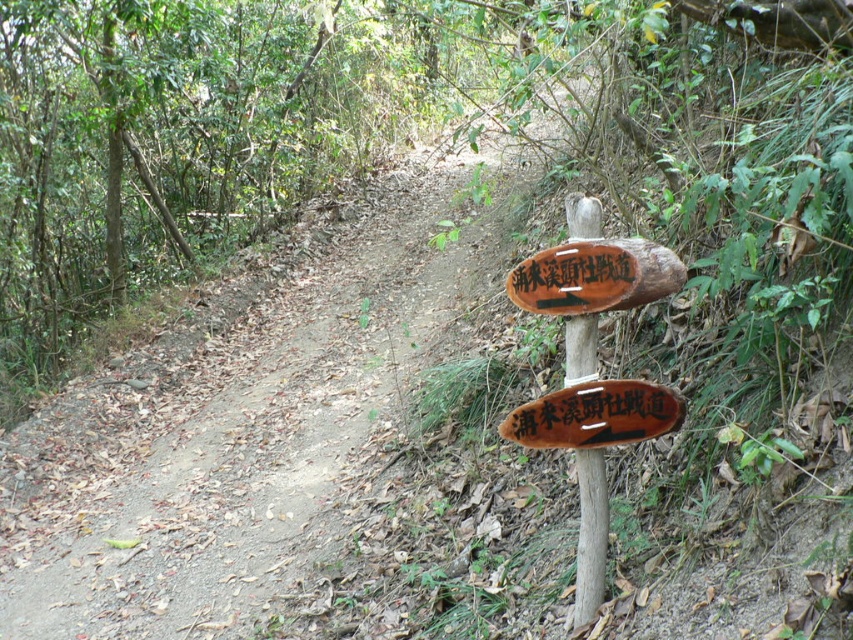
Between brown dirt track at center and wooden sign at center, which one has less height?

Standing shorter between the two is wooden sign at center.

Between point (482, 480) and point (589, 307), which one is positioned behind?

The point (482, 480) is more distant.

Is point (103, 592) positioned before point (519, 305)?

No, (103, 592) is further to viewer.

I want to click on brown dirt track at center, so click(x=250, y=429).

Does wooden sign at center-right appear on the right side of wooden signpost at center?

Correct, you'll find wooden sign at center-right to the right of wooden signpost at center.

Looking at this image, is wooden sign at center-right behind wooden signpost at center?

No.

Where is `wooden sign at center-right`? The width and height of the screenshot is (853, 640). wooden sign at center-right is located at coordinates [592, 369].

Locate an element on the screen. This screenshot has height=640, width=853. wooden sign at center-right is located at coordinates (592, 369).

Measure the distance between brown dirt track at center and brown wooden sign at center.

brown dirt track at center is 3.67 meters from brown wooden sign at center.

Does brown dirt track at center have a lesser width compared to brown wooden sign at center?

Yes.

Identify the location of brown dirt track at center. The width and height of the screenshot is (853, 640). (250, 429).